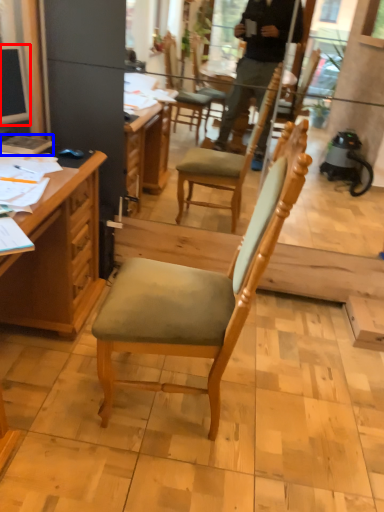
Question: Which point is further to the camera, television (highlighted by a red box) or book (highlighted by a blue box)?

Choices:
 (A) television
 (B) book

Answer: (B)